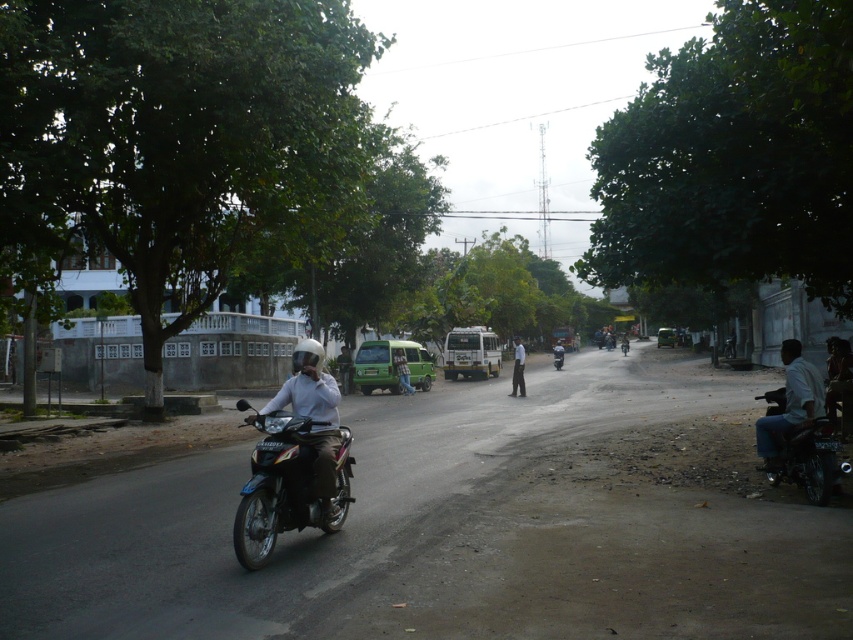
Does point (791, 445) lie behind point (514, 362)?

No, it is not.

Can you confirm if shiny black motorcycle at right is positioned to the right of white matte shirt at center?

Correct, you'll find shiny black motorcycle at right to the right of white matte shirt at center.

Find the location of a particular element. shiny black motorcycle at right is located at coordinates (808, 460).

Between shiny black motorcycle at right and black glossy motorcycle at center, which one has less height?

shiny black motorcycle at right is shorter.

Describe the element at coordinates (808, 460) in the screenshot. I see `shiny black motorcycle at right` at that location.

Where is `shiny black motorcycle at right`? shiny black motorcycle at right is located at coordinates (808, 460).

Is shiny black motorcycle at center-left taller than matte white helmet at center?

No, shiny black motorcycle at center-left is not taller than matte white helmet at center.

In the scene shown: Is the position of shiny black motorcycle at center-left less distant than that of matte white helmet at center?

Yes.

Find the location of a particular element. The height and width of the screenshot is (640, 853). shiny black motorcycle at center-left is located at coordinates (286, 484).

The height and width of the screenshot is (640, 853). Identify the location of shiny black motorcycle at center-left. (286, 484).